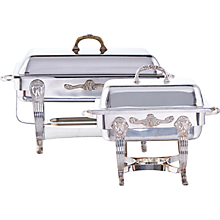
What are the coordinates of `small chafing dish left front leg` in the screenshot? It's located at (120, 184).